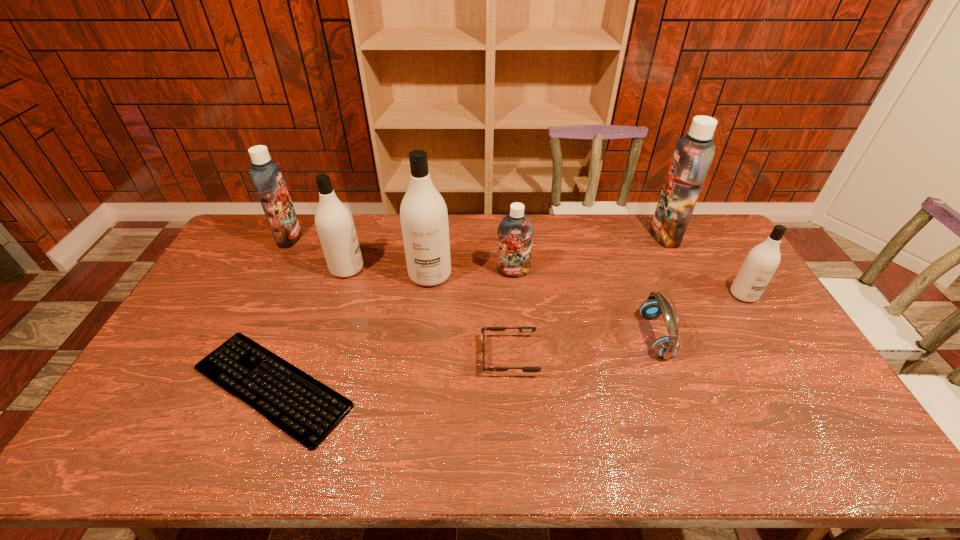
Where is `the rightmost blue shampoo`? This screenshot has width=960, height=540. the rightmost blue shampoo is located at coordinates (693, 155).

You are a GUI agent. You are given a task and a screenshot of the screen. Output one action in this format:
    pyautogui.click(x=<x>, y=<y>)
    Task: Click on the biggest blue shampoo
    
    Given the screenshot: What is the action you would take?
    pyautogui.click(x=693, y=155)

Find the location of a particular element. the sixth object from right to left is located at coordinates (423, 213).

Identify the location of the third shampoo from left to right. (423, 213).

In order to click on the leftmost blue shampoo in this screenshot , I will do `click(266, 175)`.

The image size is (960, 540). I want to click on the second biggest blue shampoo, so click(266, 175).

Image resolution: width=960 pixels, height=540 pixels. I want to click on the fifth shampoo from right to left, so click(x=334, y=222).

Locate an element on the screen. The width and height of the screenshot is (960, 540). the second smallest white shampoo is located at coordinates (334, 222).

This screenshot has width=960, height=540. Find the location of `the nearest blue shampoo`. the nearest blue shampoo is located at coordinates [x=515, y=231].

Locate an element on the screen. The image size is (960, 540). the fourth shampoo from left to right is located at coordinates (515, 231).